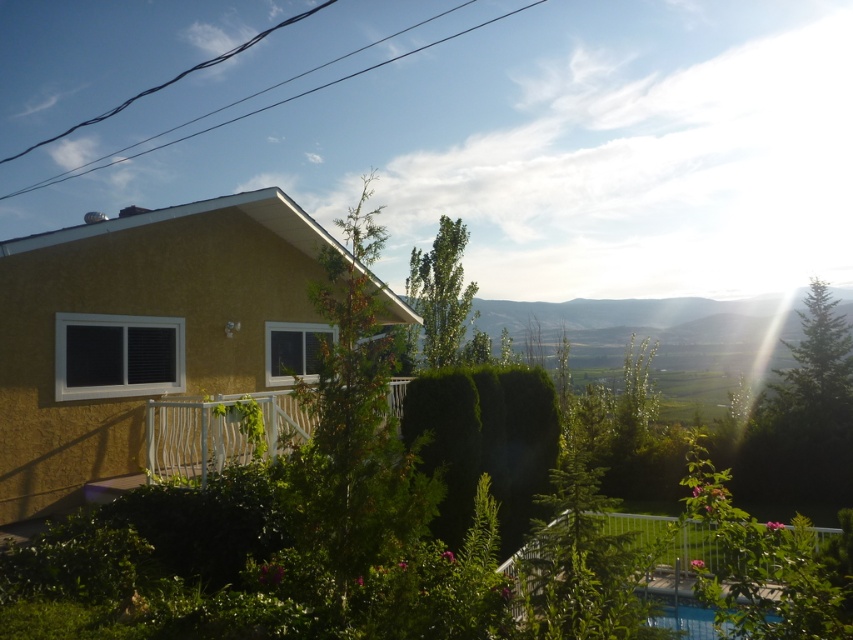
You are a guest arriving at this house and want to enter through the front door. You see the black wire at upper center and the transparent glass pool at lower right. Which object is closer to the front door?

The transparent glass pool at lower right is behind the black wire at upper center, so the black wire at upper center is closer to the front door.